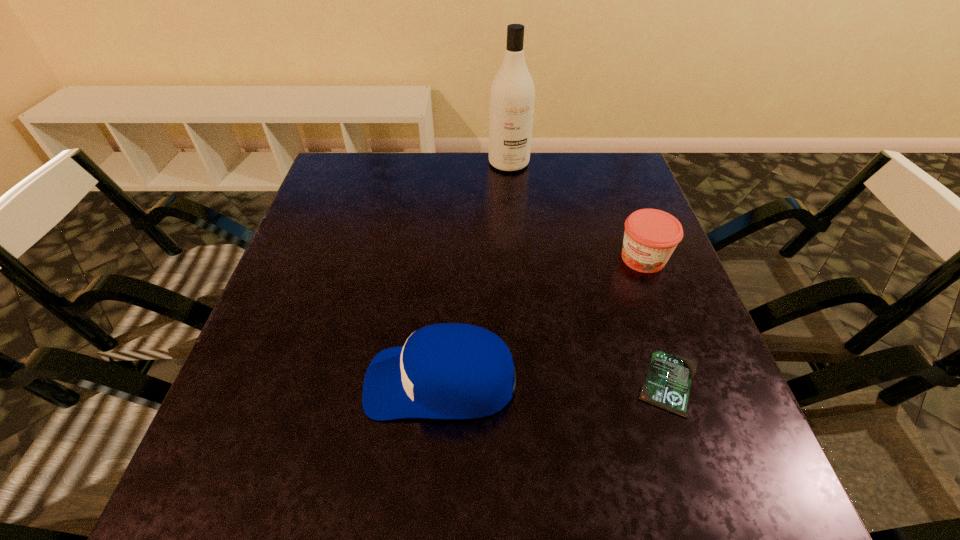
Identify the location of baseball cap. Image resolution: width=960 pixels, height=540 pixels. (449, 370).

The height and width of the screenshot is (540, 960). I want to click on identity card, so click(x=667, y=386).

The width and height of the screenshot is (960, 540). Find the location of `jam`. jam is located at coordinates (650, 237).

Where is `the tallest object`? Image resolution: width=960 pixels, height=540 pixels. the tallest object is located at coordinates (512, 94).

Image resolution: width=960 pixels, height=540 pixels. I want to click on the farthest object, so click(x=512, y=94).

You are a GUI agent. You are given a task and a screenshot of the screen. Output one action in this format:
    pyautogui.click(x=<x>, y=<y>)
    Task: Click on the free space located on the front-facing side of the baseball cap
    The height and width of the screenshot is (540, 960).
    Given the screenshot: What is the action you would take?
    pyautogui.click(x=252, y=382)

Find the location of `vacant space located on the front-facing side of the baseball cap`. vacant space located on the front-facing side of the baseball cap is located at coordinates (240, 382).

The image size is (960, 540). What are the coordinates of `free space located 0.070m on the front-facing side of the baseball cap` in the screenshot? It's located at (327, 382).

Locate an element on the screen. The height and width of the screenshot is (540, 960). vacant space located 0.210m on the left of the identity card is located at coordinates (519, 383).

Locate an element on the screen. The height and width of the screenshot is (540, 960). free space located on the front label of the jam is located at coordinates (573, 342).